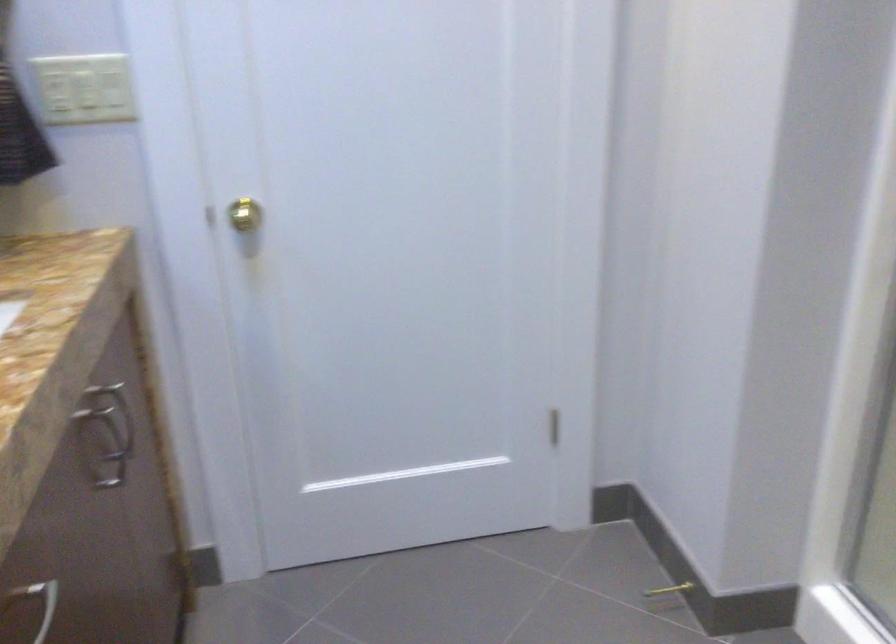
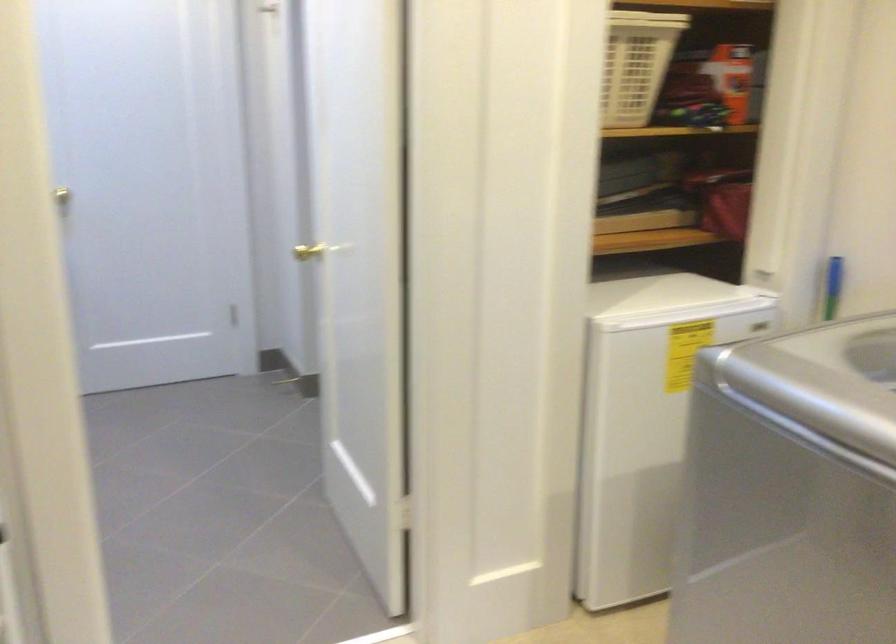
Where in the second image is the point corresponding to the point at 238,223 from the first image?

(71, 192)